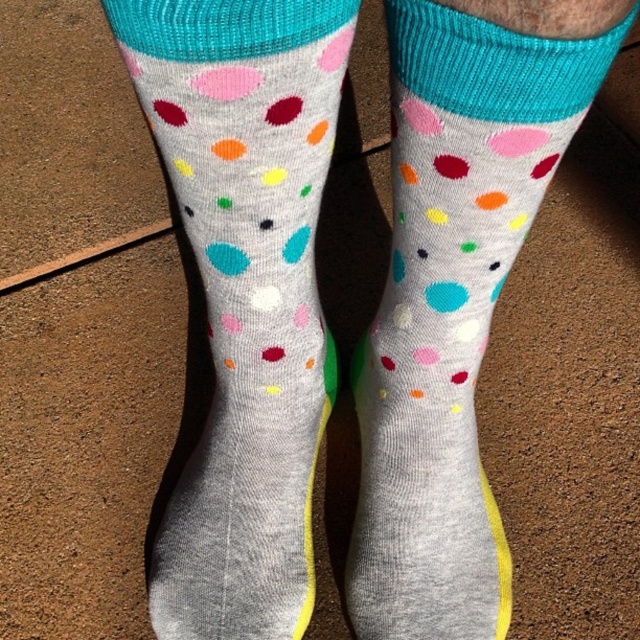
Question: Which point is farther to the camera?

Choices:
 (A) (464, 403)
 (B) (182, 550)

Answer: (B)

Question: Does gray cotton socks at center appear under matte gray socks with colorful polka dots at center?

Choices:
 (A) no
 (B) yes

Answer: (A)

Question: Can you confirm if gray cotton socks at center is thinner than matte gray socks with colorful polka dots at center?

Choices:
 (A) yes
 (B) no

Answer: (B)

Question: Does gray cotton socks at center appear on the right side of matte gray socks with colorful polka dots at center?

Choices:
 (A) yes
 (B) no

Answer: (B)